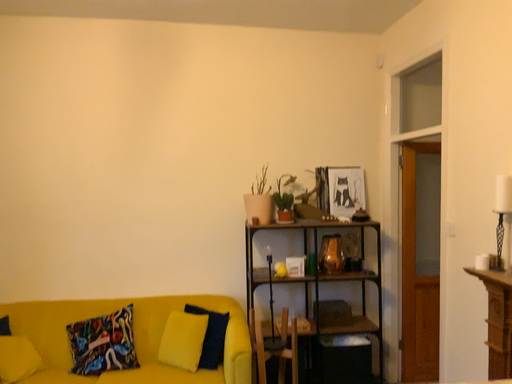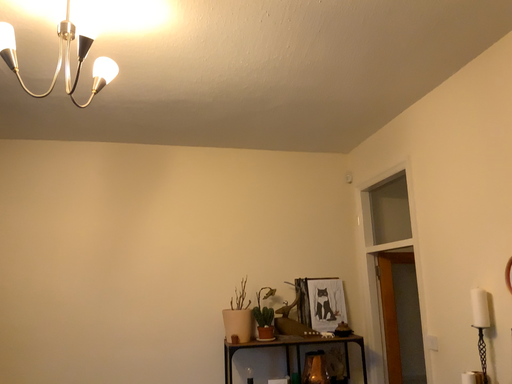
Question: How did the camera likely rotate when shooting the video?

Choices:
 (A) rotated upward
 (B) rotated downward

Answer: (A)